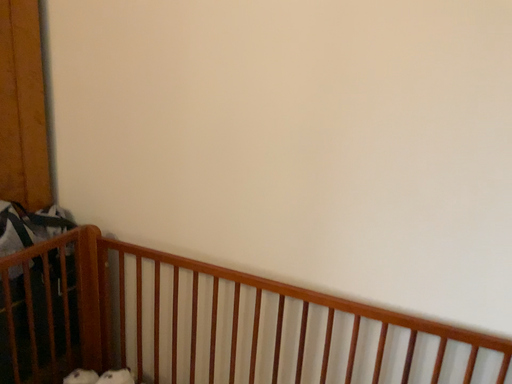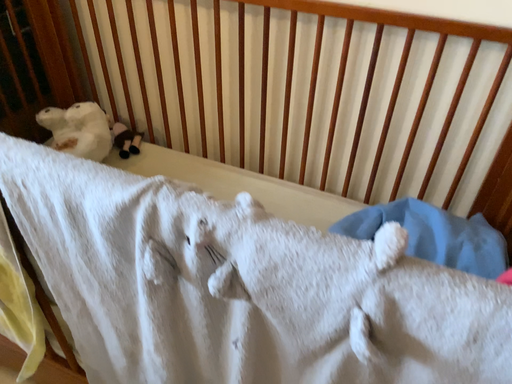
Question: How did the camera likely rotate when shooting the video?

Choices:
 (A) rotated upward
 (B) rotated downward

Answer: (B)